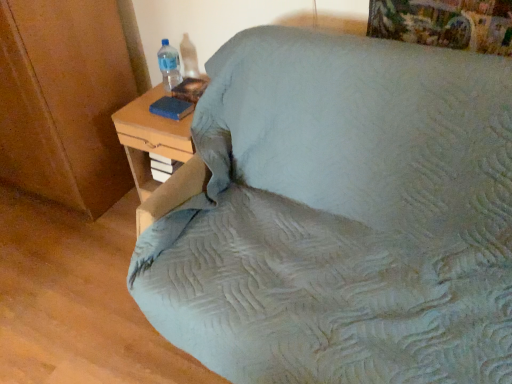
Question: Is the position of blue matte book at upper left less distant than that of light blue fabric bed at center?

Choices:
 (A) yes
 (B) no

Answer: (B)

Question: Is light blue fabric bed at center surrounded by blue matte book at upper left?

Choices:
 (A) no
 (B) yes

Answer: (A)

Question: From a real-world perspective, is blue matte book at upper left positioned under light blue fabric bed at center based on gravity?

Choices:
 (A) no
 (B) yes

Answer: (A)

Question: Considering the relative positions of blue matte book at upper left and light blue fabric bed at center in the image provided, is blue matte book at upper left to the left of light blue fabric bed at center from the viewer's perspective?

Choices:
 (A) yes
 (B) no

Answer: (A)

Question: From a real-world perspective, is blue matte book at upper left physically above light blue fabric bed at center?

Choices:
 (A) yes
 (B) no

Answer: (A)

Question: Is woodennightstand at right inside or outside of transparent plastic bottle at upper left?

Choices:
 (A) inside
 (B) outside

Answer: (B)

Question: Considering the positions of woodennightstand at right and transparent plastic bottle at upper left in the image, is woodennightstand at right taller or shorter than transparent plastic bottle at upper left?

Choices:
 (A) short
 (B) tall

Answer: (B)

Question: In terms of size, does woodennightstand at right appear bigger or smaller than transparent plastic bottle at upper left?

Choices:
 (A) big
 (B) small

Answer: (A)

Question: From a real-world perspective, relative to transparent plastic bottle at upper left, is woodennightstand at right vertically above or below?

Choices:
 (A) below
 (B) above

Answer: (A)

Question: Is transparent plastic bottle at upper left inside or outside of woodennightstand at right?

Choices:
 (A) inside
 (B) outside

Answer: (B)

Question: In terms of height, does transparent plastic bottle at upper left look taller or shorter compared to woodennightstand at right?

Choices:
 (A) short
 (B) tall

Answer: (A)

Question: In terms of width, does transparent plastic bottle at upper left look wider or thinner when compared to woodennightstand at right?

Choices:
 (A) thin
 (B) wide

Answer: (A)

Question: Is transparent plastic bottle at upper left bigger or smaller than woodennightstand at right?

Choices:
 (A) small
 (B) big

Answer: (A)

Question: Choose the correct answer: Is transparent plastic bottle at upper left inside blue matte book at upper left or outside it?

Choices:
 (A) outside
 (B) inside

Answer: (A)

Question: Does point (173, 72) appear closer or farther from the camera than point (177, 99)?

Choices:
 (A) farther
 (B) closer

Answer: (A)